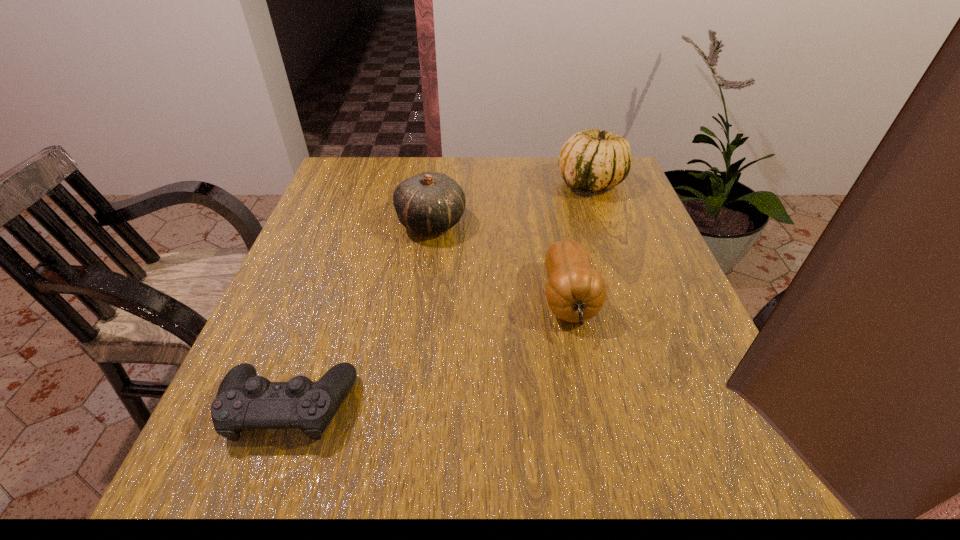
Locate an element on the screen. This screenshot has height=540, width=960. object that can be found as the second closest to the second nearest object is located at coordinates (591, 160).

Locate which object is the second closest to the second nearest object. Please provide its 2D coordinates. Your answer should be formatted as a tuple, i.e. [(x, y)], where the tuple contains the x and y coordinates of a point satisfying the conditions above.

[(591, 160)]

You are a GUI agent. You are given a task and a screenshot of the screen. Output one action in this format:
    pyautogui.click(x=<x>, y=<y>)
    Task: Click on the gourd that is the closest to the shortest object
    
    Given the screenshot: What is the action you would take?
    pyautogui.click(x=575, y=292)

At what (x,y) coordinates should I click in order to perform the action: click on the closest gourd to the leftmost object. Please return your answer as a coordinate pair (x, y). Looking at the image, I should click on (575, 292).

I want to click on vacant position in the image that satisfies the following two spatial constraints: 1. on the back side of the leftmost gourd; 2. on the right side of the farthest gourd, so click(x=437, y=183).

What are the coordinates of `free spot that satisfies the following two spatial constraints: 1. on the back side of the second object from left to right; 2. on the right side of the leftmost object` in the screenshot? It's located at (354, 222).

Where is `blank area in the image that satisfies the following two spatial constraints: 1. on the back side of the third object from right to left; 2. on the left side of the farthest gourd`? blank area in the image that satisfies the following two spatial constraints: 1. on the back side of the third object from right to left; 2. on the left side of the farthest gourd is located at coordinates (437, 183).